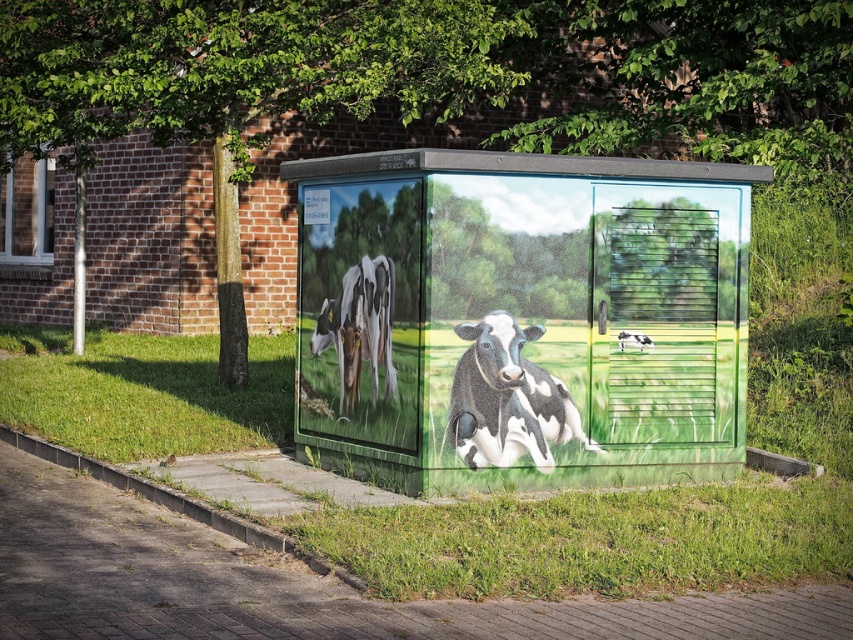
Question: Does green leafy tree at upper left have a larger size compared to black-and-white cow at center?

Choices:
 (A) no
 (B) yes

Answer: (B)

Question: Does green leafy tree at upper left have a larger size compared to black-and-white cow at center?

Choices:
 (A) yes
 (B) no

Answer: (A)

Question: Which object is closer to the camera taking this photo?

Choices:
 (A) black-and-white cow at center
 (B) black and white cow at center
 (C) matte glass box at center
 (D) green leafy tree at upper left

Answer: (C)

Question: Among these objects, which one is nearest to the camera?

Choices:
 (A) black-and-white cow at center
 (B) white and black spotted cow at center
 (C) black and white cow at center
 (D) matte glass box at center

Answer: (D)

Question: Does matte glass box at center have a lesser width compared to black and white cow at center?

Choices:
 (A) no
 (B) yes

Answer: (A)

Question: Which of the following is the closest to the observer?

Choices:
 (A) green leafy tree at upper left
 (B) black and white cow at center
 (C) white and black spotted cow at center

Answer: (C)